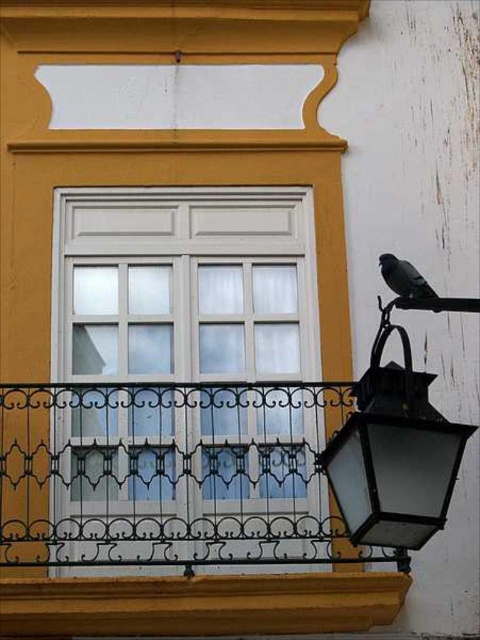
Question: Is white painted wood window at center thinner than gray matte pigeon at upper right?

Choices:
 (A) yes
 (B) no

Answer: (B)

Question: Which point is closer to the camera?

Choices:
 (A) (375, 458)
 (B) (59, 355)

Answer: (A)

Question: Can you confirm if white painted wood window at center is positioned to the right of black wrought iron at lower right?

Choices:
 (A) yes
 (B) no

Answer: (B)

Question: Is black wrought iron at lower right wider than gray matte pigeon at upper right?

Choices:
 (A) yes
 (B) no

Answer: (A)

Question: Among these points, which one is farthest from the camera?

Choices:
 (A) (412, 280)
 (B) (425, 422)
 (C) (265, 522)

Answer: (C)

Question: Among these objects, which one is nearest to the camera?

Choices:
 (A) black wrought iron at lower right
 (B) gray matte pigeon at upper right
 (C) black glass lantern at lower right
 (D) white painted wood window at center

Answer: (C)